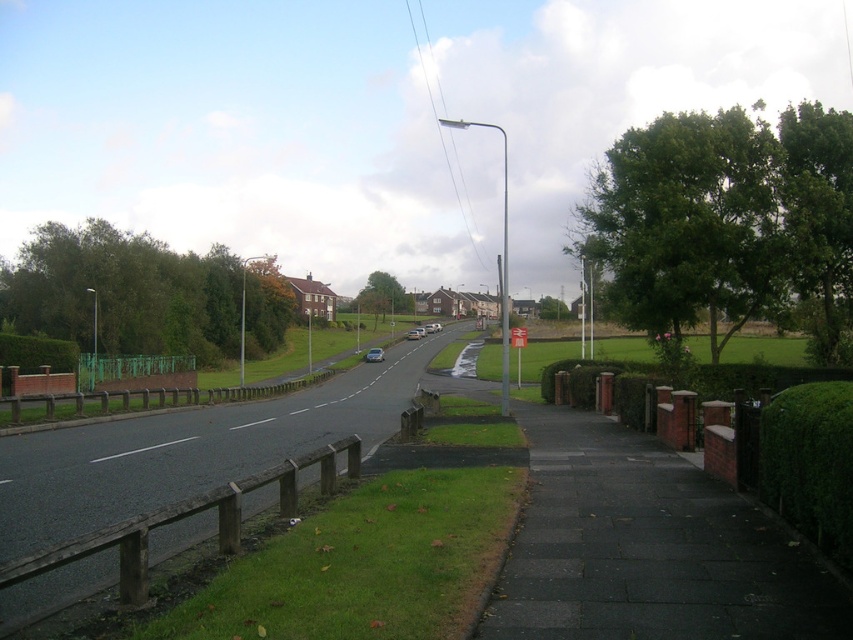
How distant is silver metallic car at center from silver metallic sedan at center?

27.98 meters

Is point (366, 356) behind point (416, 330)?

No, (366, 356) is closer to viewer.

Locate an element on the screen. Image resolution: width=853 pixels, height=640 pixels. silver metallic car at center is located at coordinates (374, 355).

Where is `silver metallic sedan at center`? The width and height of the screenshot is (853, 640). silver metallic sedan at center is located at coordinates (413, 333).

Between point (415, 333) and point (425, 332), which one is positioned in front?

Point (415, 333)

You are a GUI agent. You are given a task and a screenshot of the screen. Output one action in this format:
    pyautogui.click(x=<x>, y=<y>)
    Task: Click on the silver metallic sedan at center
    
    Given the screenshot: What is the action you would take?
    pyautogui.click(x=413, y=333)

Looking at this image, does silver metallic car at center have a lesser height compared to metallic silver car at center?

Yes, silver metallic car at center is shorter than metallic silver car at center.

Describe the element at coordinates (374, 355) in the screenshot. The image size is (853, 640). I see `silver metallic car at center` at that location.

Find the location of a particular element. The image size is (853, 640). silver metallic car at center is located at coordinates (374, 355).